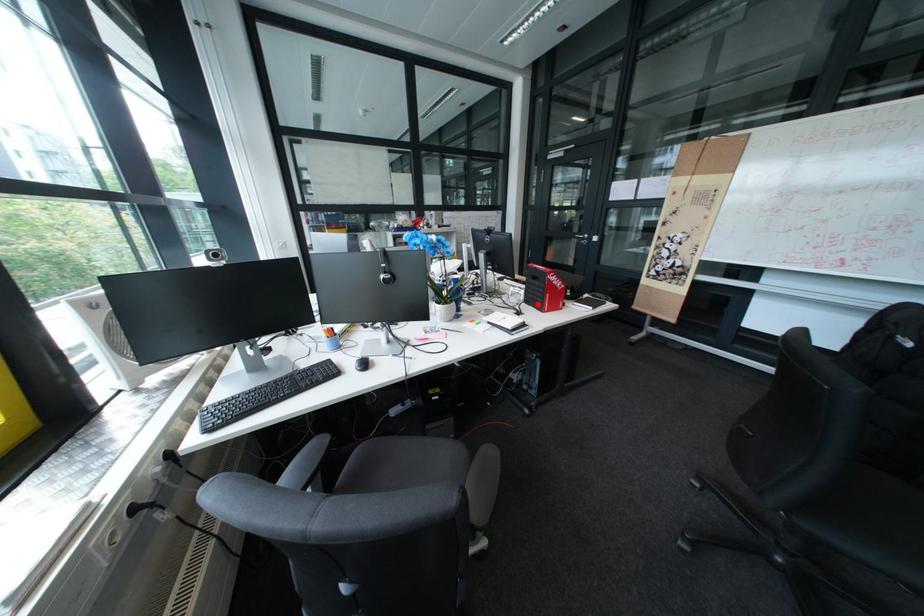
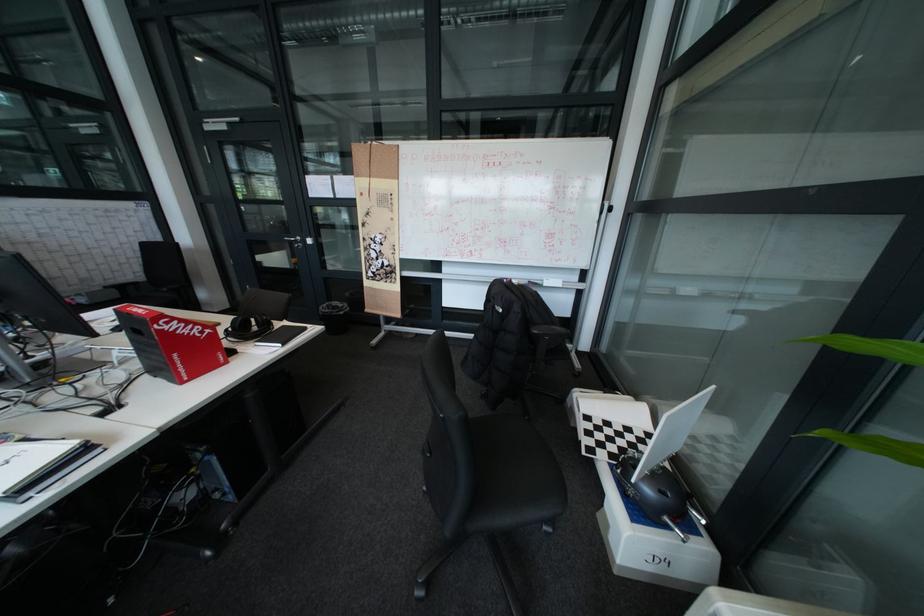
The point at the highlighted location is marked in the first image. Where is the corresponding point in the second image?

(160, 376)